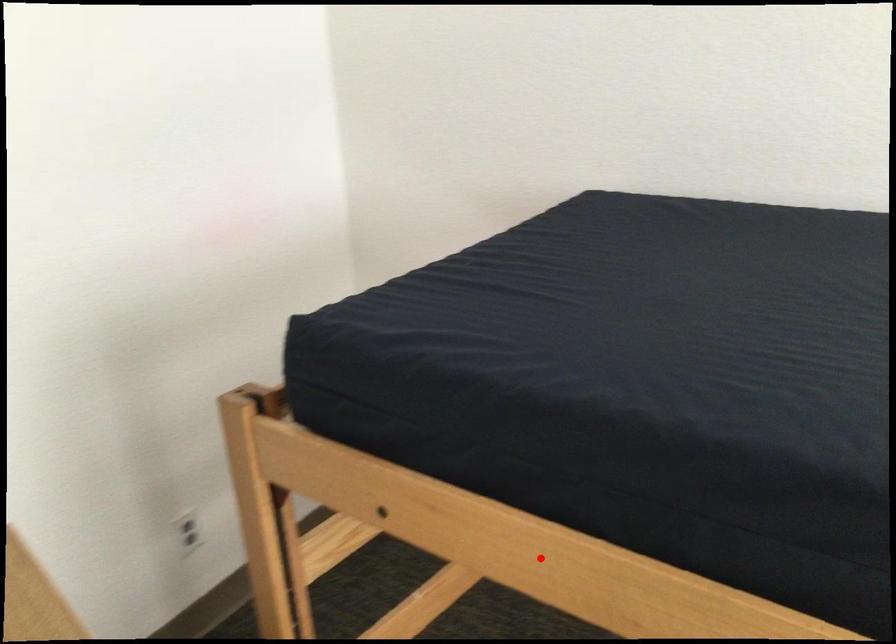
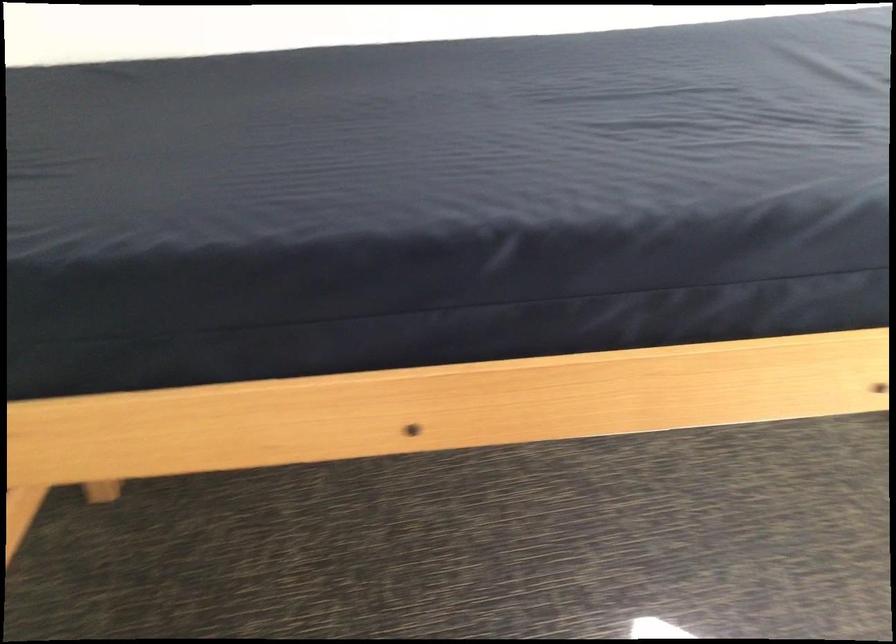
Locate, in the second image, the point that corresponds to the highlighted location in the first image.

(165, 436)